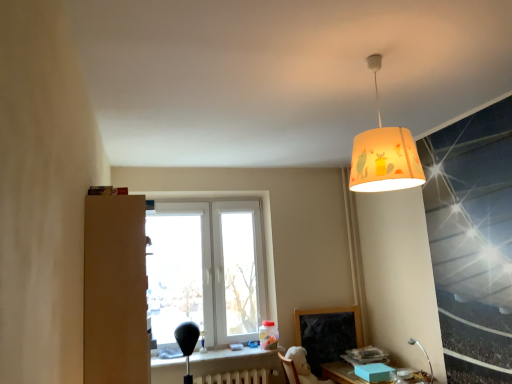
Question: Is matte black table at lower center, the 1th table viewed from the left, far away from matte wooden table at lower right, acting as the first table starting from the right?

Choices:
 (A) yes
 (B) no

Answer: (B)

Question: From a real-world perspective, is matte black table at lower center, which ranks as the second table in right-to-left order, on matte wooden table at lower right, which is counted as the second table, starting from the left?

Choices:
 (A) no
 (B) yes

Answer: (B)

Question: Is matte black table at lower center, the 1th table viewed from the left, to the left of matte wooden table at lower right, which is counted as the second table, starting from the left, from the viewer's perspective?

Choices:
 (A) no
 (B) yes

Answer: (B)

Question: Does matte black table at lower center, the 1th table viewed from the left, have a larger size compared to matte wooden table at lower right, acting as the first table starting from the right?

Choices:
 (A) yes
 (B) no

Answer: (B)

Question: Can you confirm if matte black table at lower center, the 1th table viewed from the left, is smaller than matte wooden table at lower right, which is counted as the second table, starting from the left?

Choices:
 (A) yes
 (B) no

Answer: (A)

Question: From the image's perspective, is matte black table at lower center, which ranks as the second table in right-to-left order, below matte wooden table at lower right, acting as the first table starting from the right?

Choices:
 (A) yes
 (B) no

Answer: (B)

Question: Are white plush swivel chair at lower center and white painted metal radiator at lower center far apart?

Choices:
 (A) yes
 (B) no

Answer: (B)

Question: Is white plush swivel chair at lower center closer to camera compared to white painted metal radiator at lower center?

Choices:
 (A) yes
 (B) no

Answer: (A)

Question: From a real-world perspective, does white plush swivel chair at lower center sit lower than white painted metal radiator at lower center?

Choices:
 (A) yes
 (B) no

Answer: (B)

Question: Is white plush swivel chair at lower center at the left side of white painted metal radiator at lower center?

Choices:
 (A) yes
 (B) no

Answer: (B)

Question: Does white plush swivel chair at lower center have a greater height compared to white painted metal radiator at lower center?

Choices:
 (A) no
 (B) yes

Answer: (B)

Question: Can you confirm if white plush swivel chair at lower center is bigger than white painted metal radiator at lower center?

Choices:
 (A) no
 (B) yes

Answer: (B)

Question: Considering the relative sizes of matte yellow lampshade at upper center and white plastic window at center in the image provided, is matte yellow lampshade at upper center wider than white plastic window at center?

Choices:
 (A) yes
 (B) no

Answer: (A)